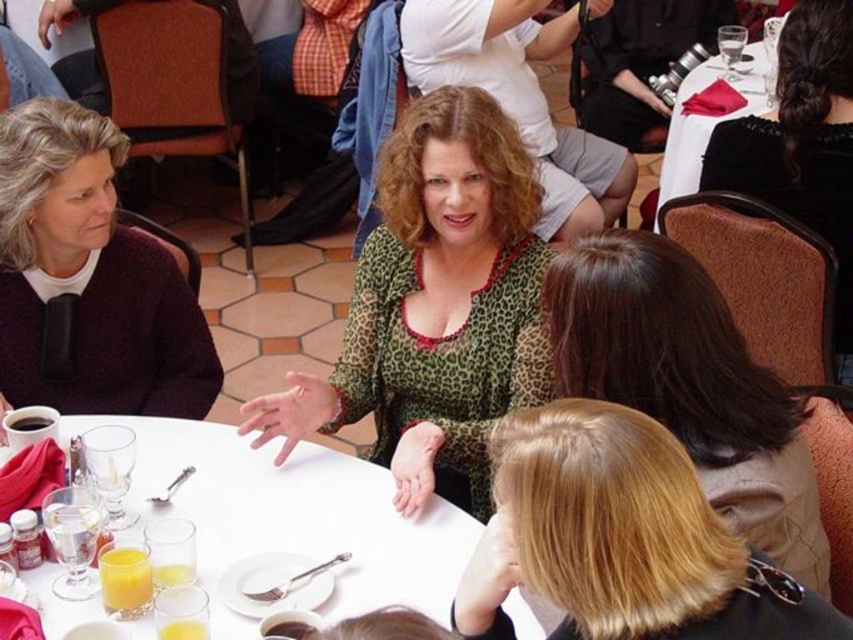
You are standing at the entrance of the banquet hall and see two points marked on the floor. The first point is at coordinate point (376, 296) and the second point is at coordinate point (708, 316). Which point is closer to you?

Point (376, 296) is further to the camera than point (708, 316), so the second point is closer to you.

You are a photographer at this event and want to capture a photo of both the black satin hair at upper right and the translucent glass cup at lower left in the same frame. Based on their heights, which object will appear larger in the photo?

The black satin hair at upper right is taller than the translucent glass cup at lower left, so it will appear larger in the photo.

You are a server at the event and need to place a large platter of food on the table. Considering the space available between the white glossy table at center and the translucent glass cup at lower left, will there be enough room for the platter?

The white glossy table at center is wider than the translucent glass cup at lower left, so there should be sufficient space to place the large platter of food on the table.